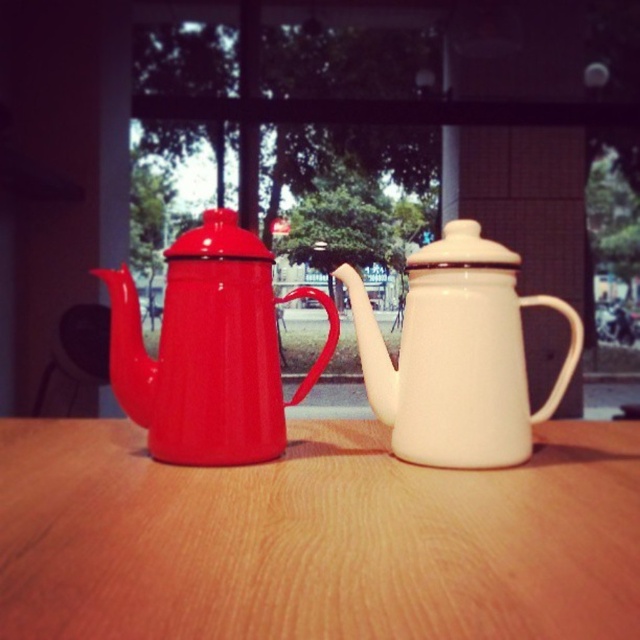
Question: Which object is farther from the camera taking this photo?

Choices:
 (A) matte enamel teapot at center
 (B) matte enamel teapot at left
 (C) white glossy teapot at center

Answer: (C)

Question: Which of these objects is positioned farthest from the matte enamel teapot at left?

Choices:
 (A) white glossy teapot at center
 (B) wooden table at center

Answer: (B)

Question: Among these points, which one is farthest from the camera?

Choices:
 (A) (200, 307)
 (B) (364, 316)
 (C) (552, 611)

Answer: (B)

Question: From the image, what is the correct spatial relationship of matte enamel teapot at left in relation to white glossy teapot at center?

Choices:
 (A) left
 (B) right

Answer: (A)

Question: Does wooden table at center appear on the right side of matte enamel teapot at left?

Choices:
 (A) no
 (B) yes

Answer: (B)

Question: Does matte enamel teapot at center appear over matte enamel teapot at left?

Choices:
 (A) no
 (B) yes

Answer: (B)